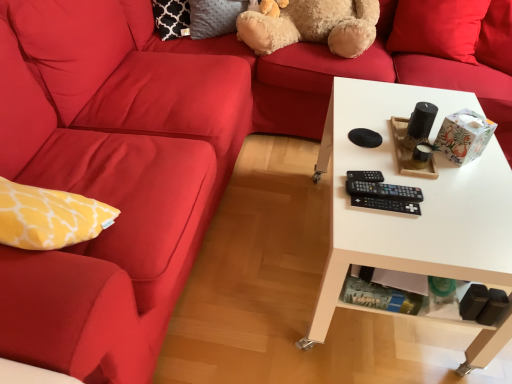
At what (x,y) coordinates should I click in order to perform the action: click on free point behind black plastic remote at center, the 1th control when ordered from front to back. Please return your answer as a coordinate pair (x, y). The image size is (512, 384). Looking at the image, I should click on (377, 160).